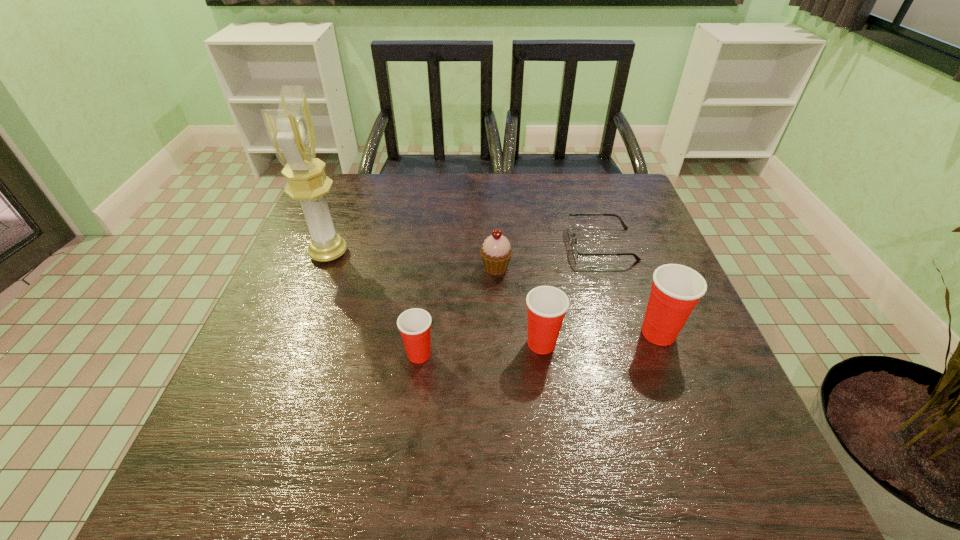
Where is `spectacles present at the right edge`? spectacles present at the right edge is located at coordinates (575, 250).

Locate an element on the screen. free space at the far edge of the desktop is located at coordinates (540, 180).

Where is `vacant space at the near edge`? This screenshot has height=540, width=960. vacant space at the near edge is located at coordinates (347, 409).

Locate an element on the screen. The height and width of the screenshot is (540, 960). free region at the left edge of the desktop is located at coordinates (315, 328).

This screenshot has height=540, width=960. I want to click on vacant space at the right edge of the desktop, so click(x=647, y=222).

You are a GUI agent. You are given a task and a screenshot of the screen. Output one action in this format:
    pyautogui.click(x=<x>, y=<y>)
    Task: Click on the free space between the shortest object and the shortest Dixie cup
    Image resolution: width=960 pixels, height=540 pixels.
    Given the screenshot: What is the action you would take?
    pyautogui.click(x=511, y=299)

Locate an element on the screen. The height and width of the screenshot is (540, 960). vacant space in between the shortest Dixie cup and the fourth object from left to right is located at coordinates (480, 349).

Where is `vacant space that is in between the spectacles and the second Dixie cup from right to left`? The image size is (960, 540). vacant space that is in between the spectacles and the second Dixie cup from right to left is located at coordinates (571, 294).

Identify the location of vacant region between the fifth shortest object and the cupcake. (577, 300).

At what (x,y) coordinates should I click in order to perform the action: click on unoccupied position between the award and the spectacles. Please return your answer as a coordinate pair (x, y). The image size is (960, 540). Looking at the image, I should click on coord(465,249).